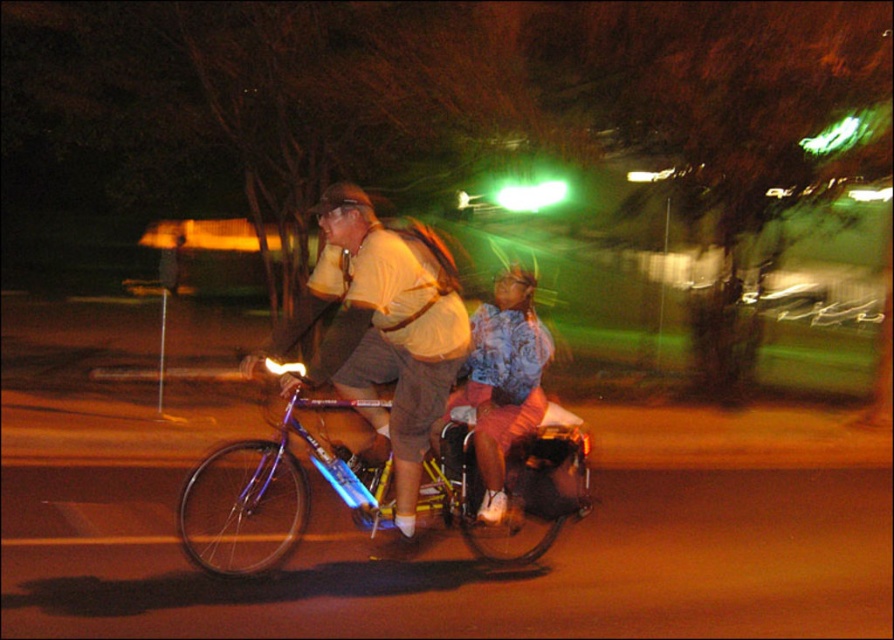
You are a photographer trying to capture a clear photo of both the matte yellow shirt at center and the blue floral shirt at center. Since you want to ensure both are in focus, which shirt should you adjust your camera focus on first, considering their widths?

The matte yellow shirt at center might be wider than blue floral shirt at center, so you should focus on the wider matte yellow shirt at center first to ensure both are in focus.